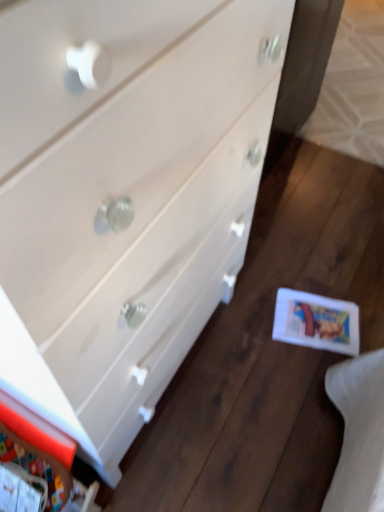
Where is `white wood chest of drawers at center`? The width and height of the screenshot is (384, 512). white wood chest of drawers at center is located at coordinates (127, 197).

The height and width of the screenshot is (512, 384). Describe the element at coordinates (127, 197) in the screenshot. I see `white wood chest of drawers at center` at that location.

The width and height of the screenshot is (384, 512). I want to click on white wood chest of drawers at center, so click(x=127, y=197).